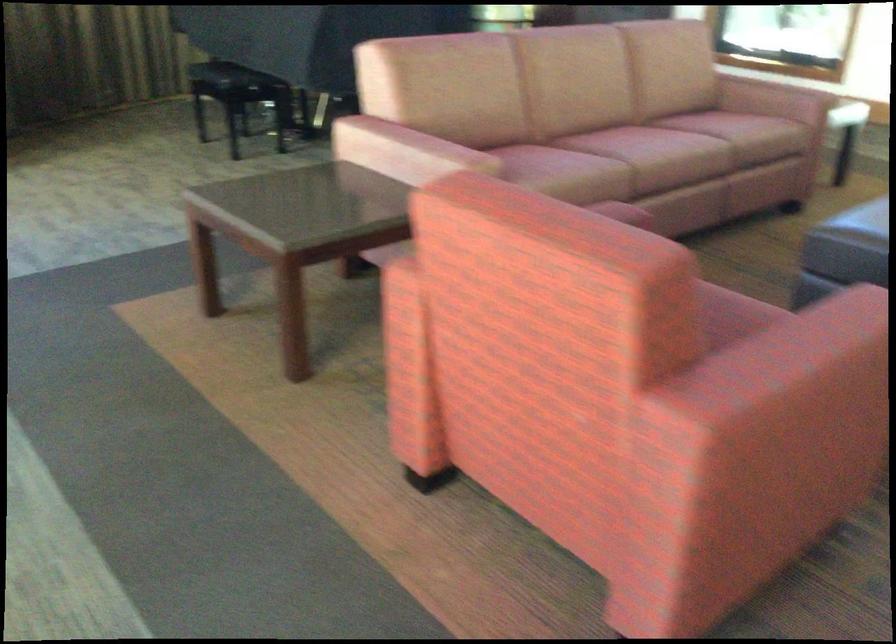
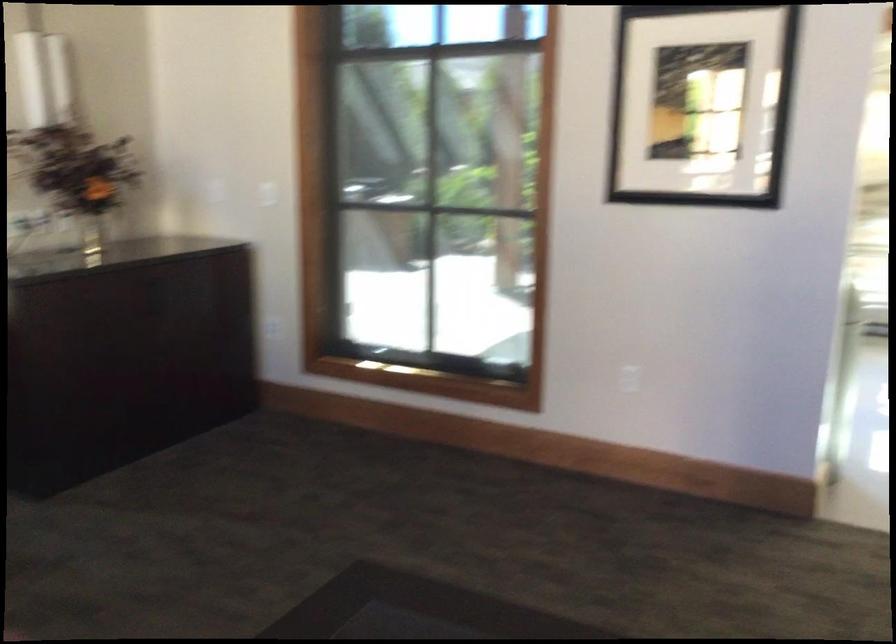
Which direction would the cameraman need to move to produce the second image?

The movement direction of the cameraman is right, forward.